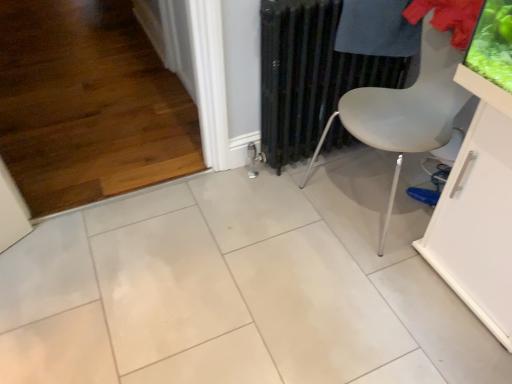
Question: Is white matte chair at center-right thinner than blue fabric shoe at lower right?

Choices:
 (A) no
 (B) yes

Answer: (A)

Question: Is white matte chair at center-right closer to camera compared to blue fabric shoe at lower right?

Choices:
 (A) yes
 (B) no

Answer: (A)

Question: Could you tell me if white matte chair at center-right is turned towards blue fabric shoe at lower right?

Choices:
 (A) no
 (B) yes

Answer: (A)

Question: Considering the relative positions of white matte chair at center-right and blue fabric shoe at lower right in the image provided, is white matte chair at center-right to the right of blue fabric shoe at lower right from the viewer's perspective?

Choices:
 (A) no
 (B) yes

Answer: (A)

Question: Would you say white matte chair at center-right is a long distance from blue fabric shoe at lower right?

Choices:
 (A) no
 (B) yes

Answer: (A)

Question: Does white matte chair at center-right have a greater width compared to blue fabric shoe at lower right?

Choices:
 (A) no
 (B) yes

Answer: (B)

Question: From a real-world perspective, is dark blue fabric at upper right located higher than white glossy table at lower right?

Choices:
 (A) yes
 (B) no

Answer: (A)

Question: From the image's perspective, is dark blue fabric at upper right below white glossy table at lower right?

Choices:
 (A) no
 (B) yes

Answer: (A)

Question: Can you confirm if dark blue fabric at upper right is positioned to the right of white glossy table at lower right?

Choices:
 (A) no
 (B) yes

Answer: (A)

Question: Is dark blue fabric at upper right shorter than white glossy table at lower right?

Choices:
 (A) no
 (B) yes

Answer: (B)

Question: Can you confirm if dark blue fabric at upper right is bigger than white glossy table at lower right?

Choices:
 (A) yes
 (B) no

Answer: (B)

Question: From the image's perspective, is dark blue fabric at upper right above white glossy table at lower right?

Choices:
 (A) yes
 (B) no

Answer: (A)

Question: Considering the relative sizes of blue fabric shoe at lower right and black metal radiator at center in the image provided, is blue fabric shoe at lower right bigger than black metal radiator at center?

Choices:
 (A) no
 (B) yes

Answer: (A)